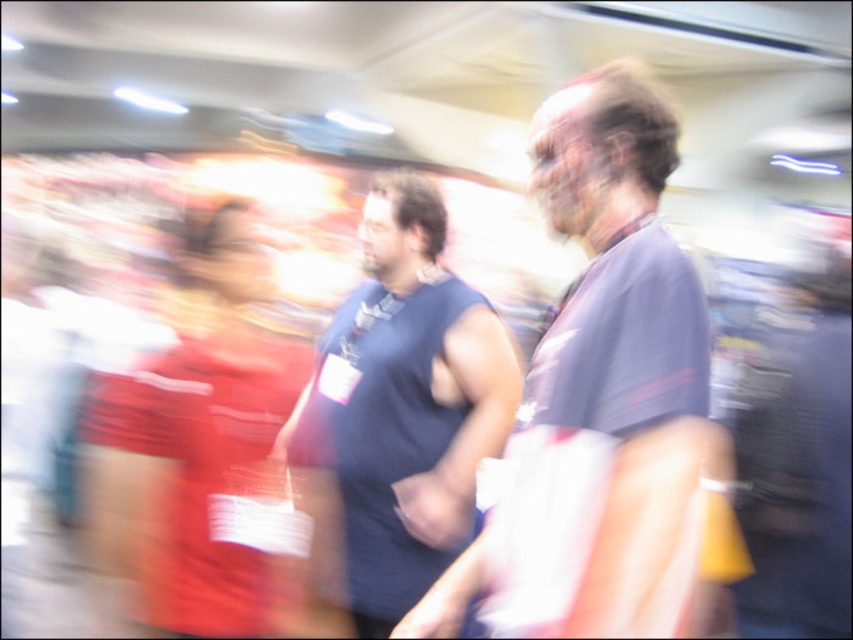
Question: Considering the real-world distances, which object is closest to the dark blue sleeveless shirt at center?

Choices:
 (A) dark blue t-shirt at center
 (B) matte red dress at left

Answer: (B)

Question: Which object is farther from the camera taking this photo?

Choices:
 (A) matte red dress at left
 (B) dark blue sleeveless shirt at center
 (C) dark blue t-shirt at center

Answer: (B)

Question: Which object appears closest to the camera in this image?

Choices:
 (A) dark blue t-shirt at center
 (B) dark blue sleeveless shirt at center

Answer: (A)

Question: Is dark blue t-shirt at center bigger than matte red dress at left?

Choices:
 (A) no
 (B) yes

Answer: (A)

Question: Does dark blue t-shirt at center have a larger size compared to matte red dress at left?

Choices:
 (A) no
 (B) yes

Answer: (A)

Question: Does dark blue t-shirt at center lie in front of dark blue sleeveless shirt at center?

Choices:
 (A) yes
 (B) no

Answer: (A)